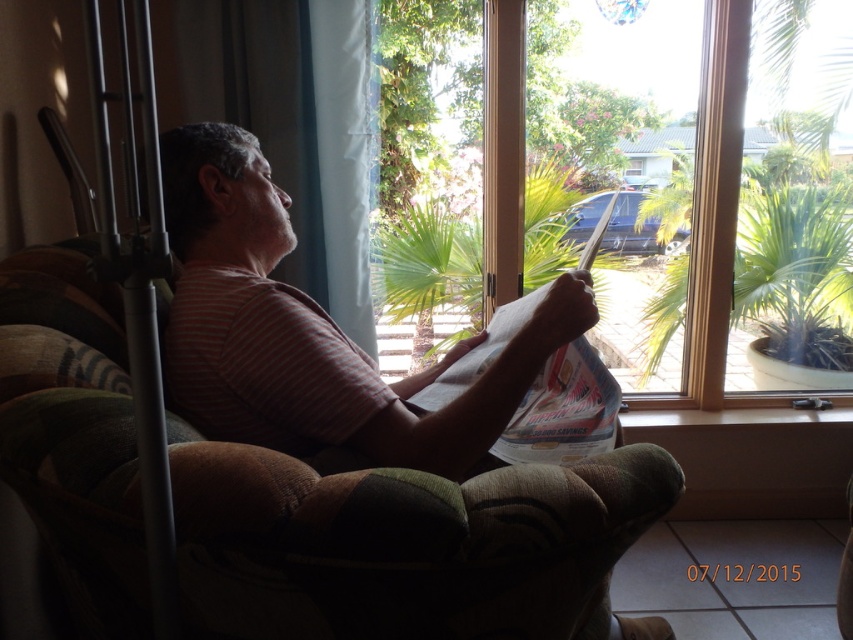
Is point (192, 380) positioned behind point (549, 209)?

No, it is not.

Does striped cotton shirt at center come behind green leafy palm tree at center?

No, striped cotton shirt at center is in front of green leafy palm tree at center.

Where is `striped cotton shirt at center`? striped cotton shirt at center is located at coordinates (312, 332).

Between clear glass window at center and white paper at center, which one is positioned higher?

Positioned higher is clear glass window at center.

Is point (619, 22) closer to camera compared to point (531, 390)?

No, (619, 22) is behind (531, 390).

Where is `clear glass window at center`? The image size is (853, 640). clear glass window at center is located at coordinates (561, 172).

From the picture: How much distance is there between clear glass window at center and striped cotton shirt at center?

A distance of 1.29 meters exists between clear glass window at center and striped cotton shirt at center.

Does clear glass window at center have a greater width compared to striped cotton shirt at center?

Yes.

Which is in front, point (659, 278) or point (178, 211)?

Positioned in front is point (178, 211).

Identify the location of clear glass window at center. The image size is (853, 640). (561, 172).